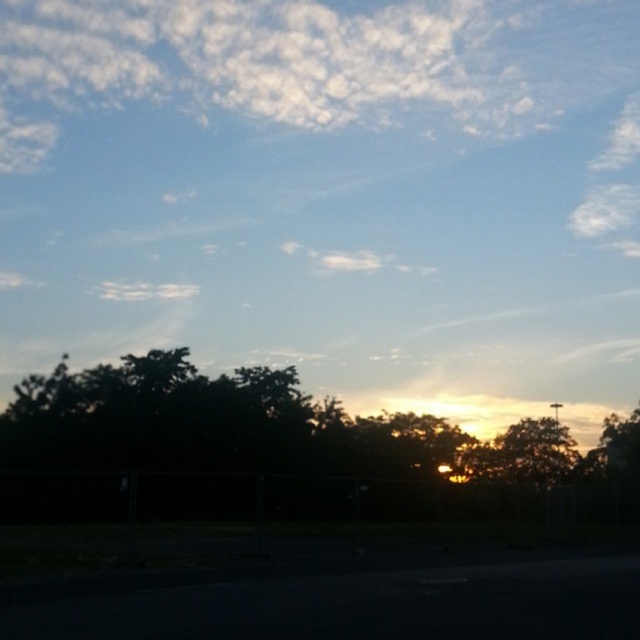
Question: Is dark green leafy tree at center to the left of metallic silver street sign at lower right from the viewer's perspective?

Choices:
 (A) no
 (B) yes

Answer: (B)

Question: In this image, where is dark green leafy tree at center located relative to metallic silver street sign at lower right?

Choices:
 (A) below
 (B) above

Answer: (B)

Question: Is dark green leafy tree at center wider than metallic silver street sign at lower right?

Choices:
 (A) no
 (B) yes

Answer: (B)

Question: Among these points, which one is farthest from the camera?

Choices:
 (A) (552, 406)
 (B) (340, 424)

Answer: (A)

Question: Among these points, which one is nearest to the camera?

Choices:
 (A) (561, 404)
 (B) (500, 484)

Answer: (B)